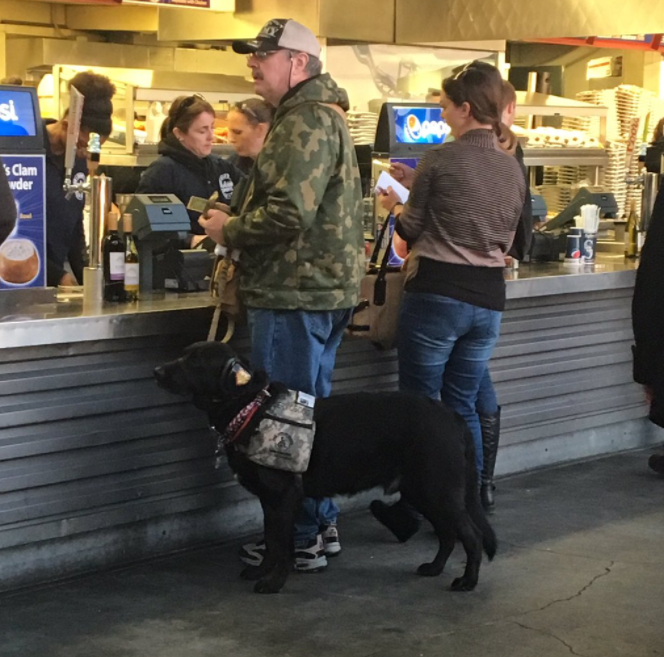
Identify the location of counter top. The width and height of the screenshot is (664, 657). (542, 273).